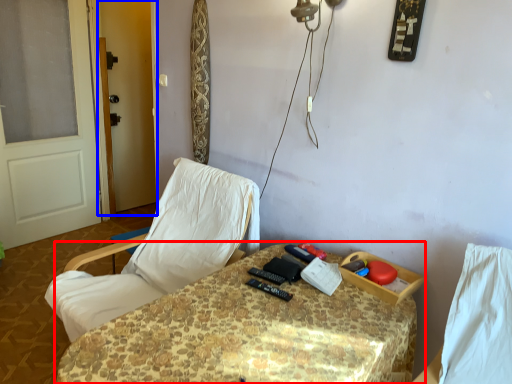
Question: Which of the following is the farthest to the observer, table (highlighted by a red box) or screen door (highlighted by a blue box)?

Choices:
 (A) table
 (B) screen door

Answer: (B)